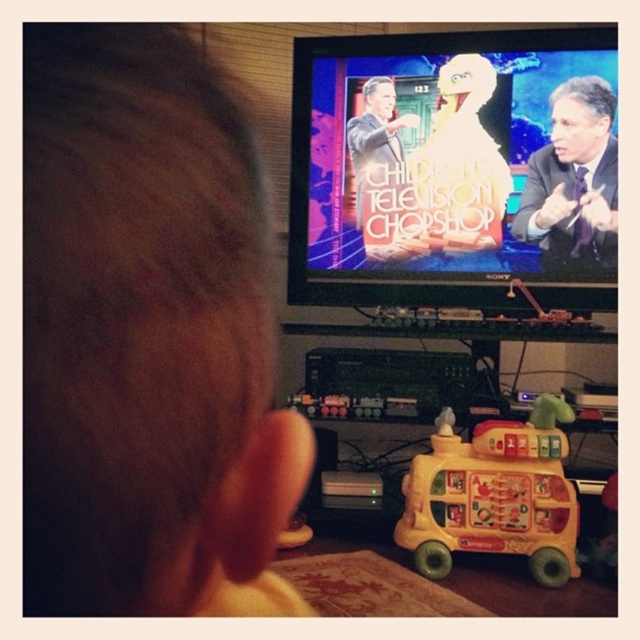
Question: Can you confirm if brown matte hair at upper left is positioned to the right of yellow plastic bus at lower center?

Choices:
 (A) no
 (B) yes

Answer: (A)

Question: Considering the relative positions of brown matte hair at upper left and yellow plastic bus at lower center in the image provided, where is brown matte hair at upper left located with respect to yellow plastic bus at lower center?

Choices:
 (A) below
 (B) above

Answer: (B)

Question: Does brown matte hair at upper left appear on the left side of yellow plastic bus at lower center?

Choices:
 (A) yes
 (B) no

Answer: (A)

Question: Among these objects, which one is farthest from the camera?

Choices:
 (A) brown matte hair at upper left
 (B) yellow plastic bus at lower center

Answer: (B)

Question: Which of the following is the farthest from the observer?

Choices:
 (A) yellow plastic bus at lower center
 (B) brown matte hair at upper left

Answer: (A)